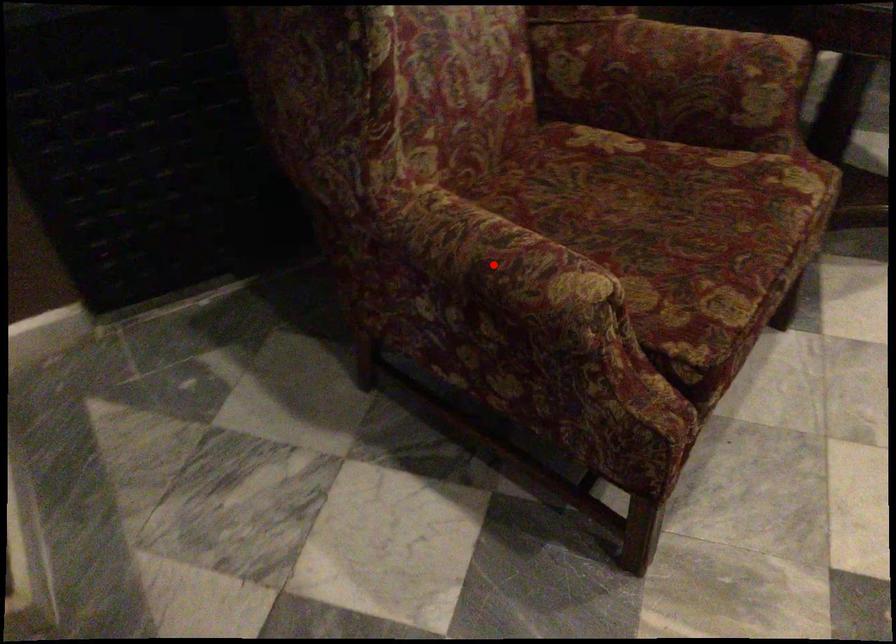
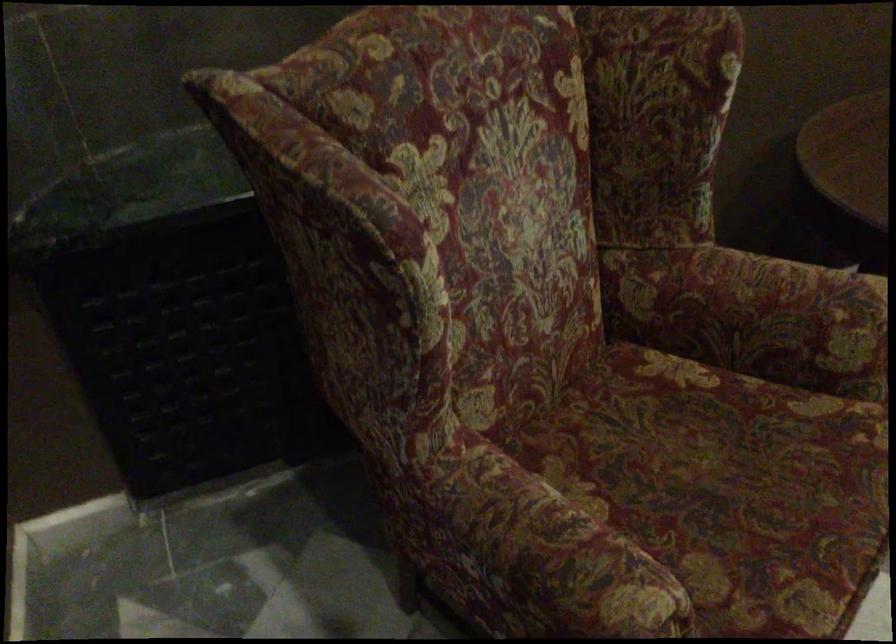
Question: I am providing you with two images of the same scene from different viewpoints. Image1 has a red point marked. In image2, the corresponding 3D location appears at what relative position? Reply with the corresponding letter.

Choices:
 (A) Closer
 (B) Farther

Answer: (A)